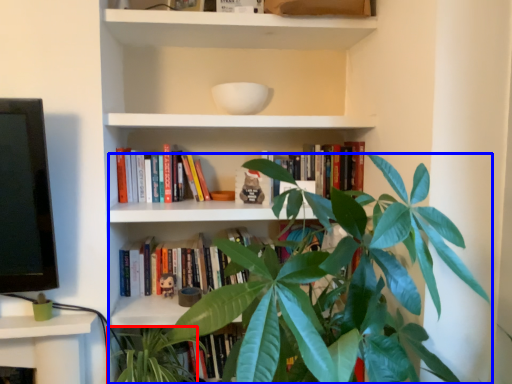
Question: Which object is closer to the camera taking this photo, vegetation (highlighted by a red box) or houseplant (highlighted by a blue box)?

Choices:
 (A) vegetation
 (B) houseplant

Answer: (B)